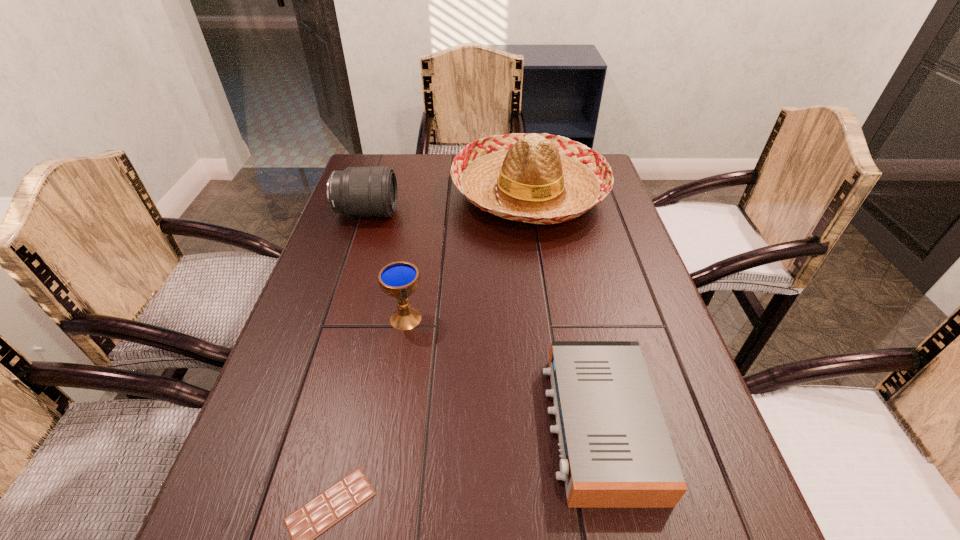
Identify the location of free space that is in between the second shortest object and the third nearest object. (502, 372).

The height and width of the screenshot is (540, 960). Identify the location of unoccupied area between the second shortest object and the telephoto lens. (483, 319).

In order to click on free space that is in between the chalice and the fourth tallest object in this screenshot , I will do (x=502, y=372).

This screenshot has width=960, height=540. Identify the location of empty space that is in between the sombrero and the chalice. (468, 255).

This screenshot has width=960, height=540. What are the coordinates of `vacant area between the chalice and the second shortest object` in the screenshot? It's located at (502, 372).

Find the location of a particular element. This screenshot has width=960, height=540. object that can be found as the second closest to the telephoto lens is located at coordinates [x=399, y=280].

Image resolution: width=960 pixels, height=540 pixels. Identify the location of object that stands as the second closest to the telephoto lens. (399, 280).

Find the location of a particular element. free space in the image that satisfies the following two spatial constraints: 1. on the back side of the chalice; 2. on the right side of the tallest object is located at coordinates (426, 193).